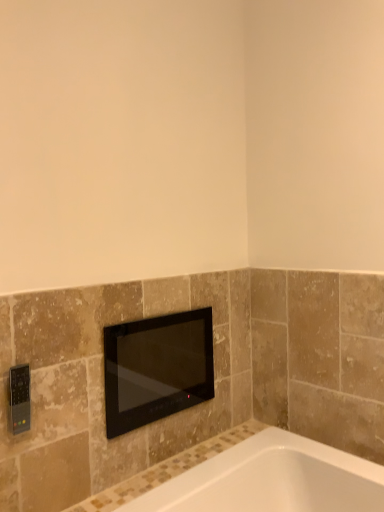
Question: From a real-world perspective, is black glass television at center located higher than black plastic remote control at lower left?

Choices:
 (A) yes
 (B) no

Answer: (B)

Question: Can black plastic remote control at lower left be found inside black glass television at center?

Choices:
 (A) yes
 (B) no

Answer: (B)

Question: Does black glass television at center have a smaller size compared to black plastic remote control at lower left?

Choices:
 (A) yes
 (B) no

Answer: (B)

Question: Is black glass television at center at the left side of black plastic remote control at lower left?

Choices:
 (A) no
 (B) yes

Answer: (A)

Question: From a real-world perspective, does black glass television at center sit lower than black plastic remote control at lower left?

Choices:
 (A) no
 (B) yes

Answer: (B)

Question: Does black glass television at center turn towards black plastic remote control at lower left?

Choices:
 (A) yes
 (B) no

Answer: (B)

Question: Would you consider black plastic remote control at lower left to be distant from black glass television at center?

Choices:
 (A) yes
 (B) no

Answer: (B)

Question: Is black plastic remote control at lower left thinner than black glass television at center?

Choices:
 (A) yes
 (B) no

Answer: (A)

Question: Is black plastic remote control at lower left surrounding black glass television at center?

Choices:
 (A) no
 (B) yes

Answer: (A)

Question: From a real-world perspective, is black plastic remote control at lower left located higher than black glass television at center?

Choices:
 (A) no
 (B) yes

Answer: (B)

Question: Can you confirm if black plastic remote control at lower left is positioned to the right of black glass television at center?

Choices:
 (A) yes
 (B) no

Answer: (B)

Question: Does black plastic remote control at lower left have a larger size compared to black glass television at center?

Choices:
 (A) no
 (B) yes

Answer: (A)

Question: Is black plastic remote control at lower left wider or thinner than black glass television at center?

Choices:
 (A) thin
 (B) wide

Answer: (A)